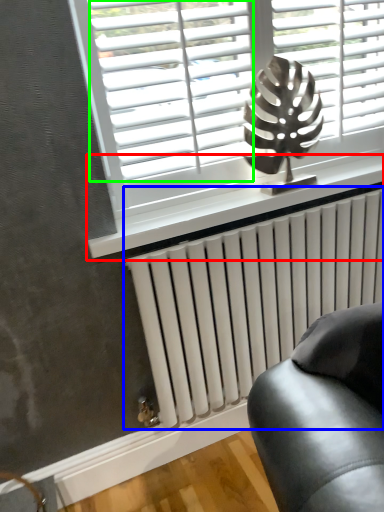
Question: Estimate the real-world distances between objects in this image. Which object is farther from window sill (highlighted by a red box), radiator (highlighted by a blue box) or blind (highlighted by a green box)?

Choices:
 (A) radiator
 (B) blind

Answer: (B)